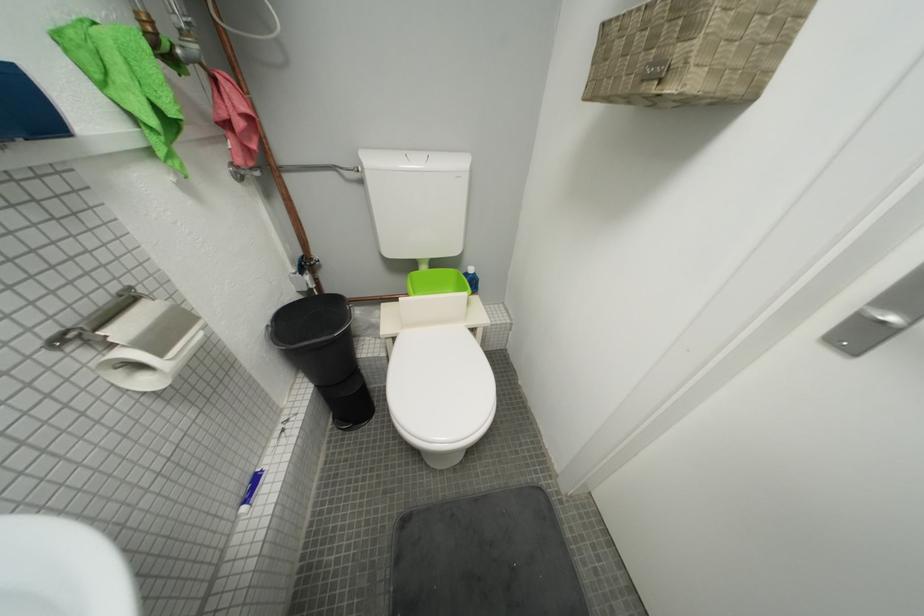
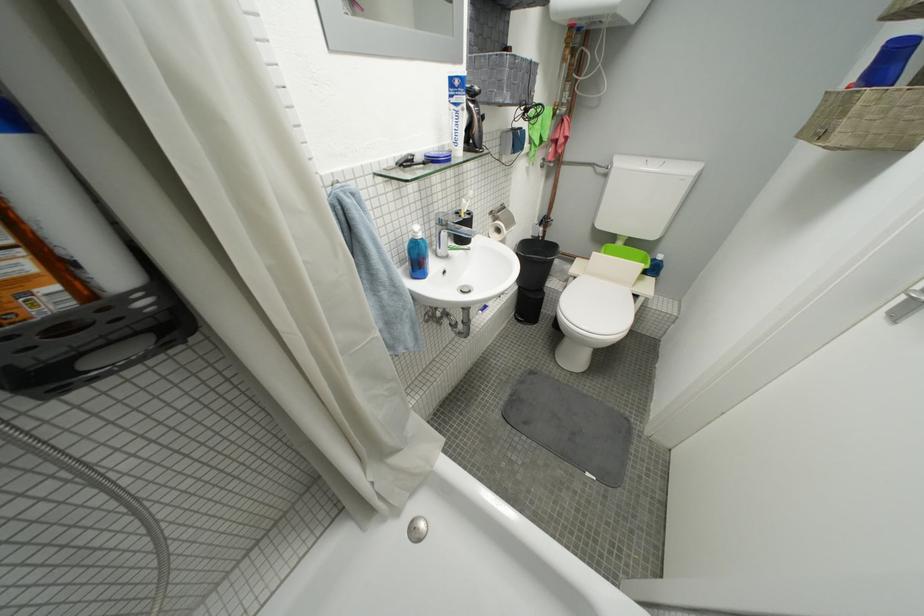
Locate, in the second image, the point that corresponds to pixel 427 164 in the first image.

(662, 169)